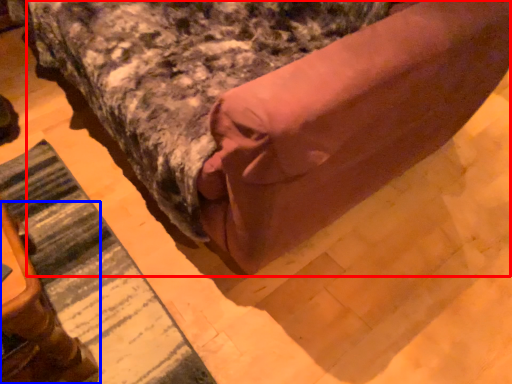
Question: Which object is closer to the camera taking this photo, bed (highlighted by a red box) or furniture (highlighted by a blue box)?

Choices:
 (A) bed
 (B) furniture

Answer: (A)